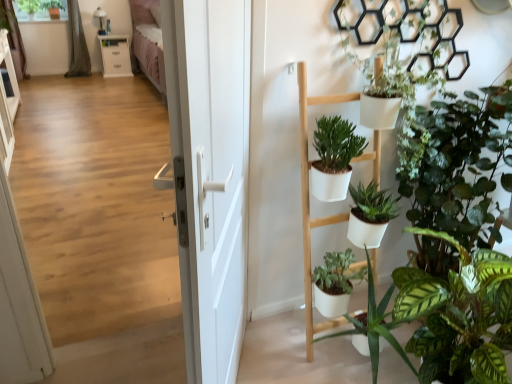
Question: Is gray fabric curtain at upper left, which is the 1th curtain in right-to-left order, outside white glossy cabinet at upper left?

Choices:
 (A) yes
 (B) no

Answer: (A)

Question: Is gray fabric curtain at upper left, which is the 1th curtain in right-to-left order, wider than white glossy cabinet at upper left?

Choices:
 (A) yes
 (B) no

Answer: (B)

Question: Is gray fabric curtain at upper left, the 2th curtain from the left, at the right side of white glossy cabinet at upper left?

Choices:
 (A) no
 (B) yes

Answer: (A)

Question: Is gray fabric curtain at upper left, the 2th curtain from the left, thinner than white glossy cabinet at upper left?

Choices:
 (A) no
 (B) yes

Answer: (B)

Question: Is gray fabric curtain at upper left, the 2th curtain from the left, looking in the opposite direction of white glossy cabinet at upper left?

Choices:
 (A) no
 (B) yes

Answer: (A)

Question: Is gray fabric curtain at upper left, the 2th curtain from the left, touching white glossy cabinet at upper left?

Choices:
 (A) yes
 (B) no

Answer: (B)

Question: Is green fabric curtain at upper left, the 1th curtain viewed from the left, outside of gray fabric curtain at upper left, which is the 1th curtain in right-to-left order?

Choices:
 (A) yes
 (B) no

Answer: (A)

Question: Is green fabric curtain at upper left, the 1th curtain viewed from the left, to the left of gray fabric curtain at upper left, the 2th curtain from the left, from the viewer's perspective?

Choices:
 (A) yes
 (B) no

Answer: (A)

Question: From the image's perspective, is green fabric curtain at upper left, the 1th curtain viewed from the left, on top of gray fabric curtain at upper left, the 2th curtain from the left?

Choices:
 (A) yes
 (B) no

Answer: (B)

Question: Is green fabric curtain at upper left, placed as the second curtain when sorted from right to left, taller than gray fabric curtain at upper left, the 2th curtain from the left?

Choices:
 (A) yes
 (B) no

Answer: (B)

Question: Considering the relative sizes of green fabric curtain at upper left, placed as the second curtain when sorted from right to left, and gray fabric curtain at upper left, the 2th curtain from the left, in the image provided, is green fabric curtain at upper left, placed as the second curtain when sorted from right to left, smaller than gray fabric curtain at upper left, the 2th curtain from the left,?

Choices:
 (A) yes
 (B) no

Answer: (A)

Question: Is green fabric curtain at upper left, placed as the second curtain when sorted from right to left, thinner than gray fabric curtain at upper left, the 2th curtain from the left?

Choices:
 (A) no
 (B) yes

Answer: (B)

Question: From the image's perspective, is white glossy cabinet at upper left above wooden floor at center?

Choices:
 (A) no
 (B) yes

Answer: (B)